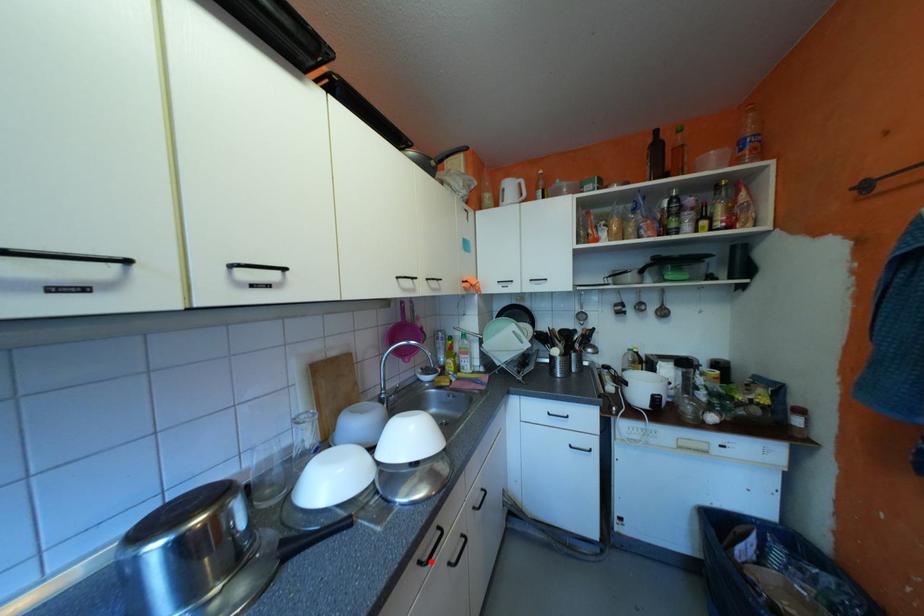
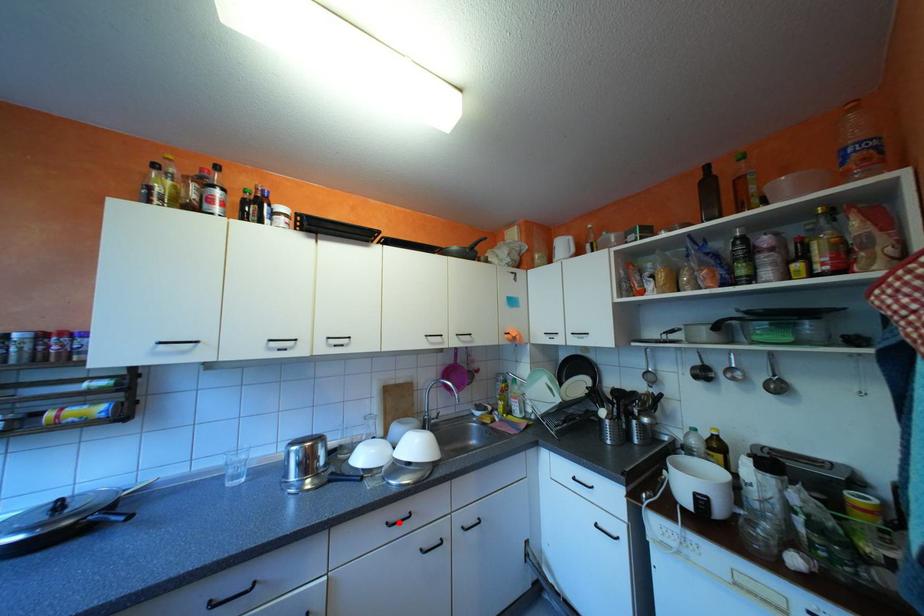
I am providing you with two images of the same scene from different viewpoints. A red point is marked on the first image and another point is marked on the second image. Is the red point in image1 aligned with the point shown in image2?

Yes